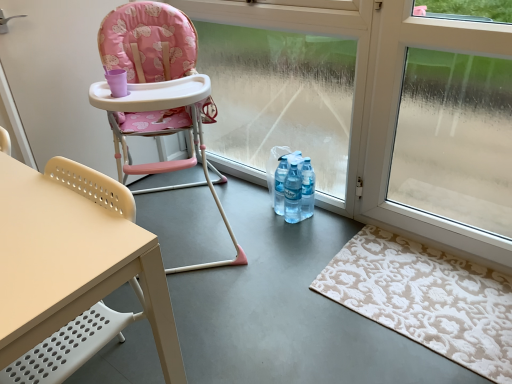
Question: Is beige plastic chair at left, marked as the 1th chair in a front-to-back arrangement, not within beige textured rug at lower right?

Choices:
 (A) yes
 (B) no

Answer: (A)

Question: Is beige plastic chair at left, marked as the 1th chair in a front-to-back arrangement, positioned before beige textured rug at lower right?

Choices:
 (A) yes
 (B) no

Answer: (A)

Question: Does beige plastic chair at left, marked as the 1th chair in a front-to-back arrangement, have a larger size compared to beige textured rug at lower right?

Choices:
 (A) no
 (B) yes

Answer: (B)

Question: Can you confirm if beige plastic chair at left, marked as the 1th chair in a front-to-back arrangement, is smaller than beige textured rug at lower right?

Choices:
 (A) no
 (B) yes

Answer: (A)

Question: From the image's perspective, is beige plastic chair at left, marked as the 1th chair in a front-to-back arrangement, under beige textured rug at lower right?

Choices:
 (A) yes
 (B) no

Answer: (B)

Question: From the image's perspective, is beige plastic chair at left, marked as the 1th chair in a front-to-back arrangement, on beige textured rug at lower right?

Choices:
 (A) yes
 (B) no

Answer: (A)

Question: Is transparent glass window at center to the right of translucent plastic bottles at center from the viewer's perspective?

Choices:
 (A) yes
 (B) no

Answer: (B)

Question: Can you confirm if transparent glass window at center is smaller than translucent plastic bottles at center?

Choices:
 (A) yes
 (B) no

Answer: (B)

Question: Does transparent glass window at center have a greater height compared to translucent plastic bottles at center?

Choices:
 (A) yes
 (B) no

Answer: (A)

Question: Does transparent glass window at center have a larger size compared to translucent plastic bottles at center?

Choices:
 (A) no
 (B) yes

Answer: (B)

Question: From the image's perspective, is transparent glass window at center on translucent plastic bottles at center?

Choices:
 (A) yes
 (B) no

Answer: (A)

Question: Is transparent glass window at center shorter than translucent plastic bottles at center?

Choices:
 (A) no
 (B) yes

Answer: (A)

Question: Is translucent plastic bottles at center bigger than beige textured rug at lower right?

Choices:
 (A) no
 (B) yes

Answer: (B)